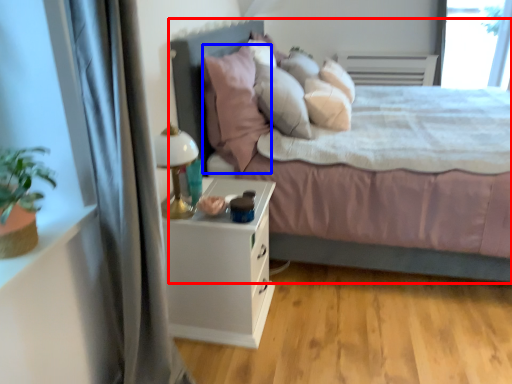
Question: Which object appears closest to the camera in this image, bed (highlighted by a red box) or pillow (highlighted by a blue box)?

Choices:
 (A) bed
 (B) pillow

Answer: (A)